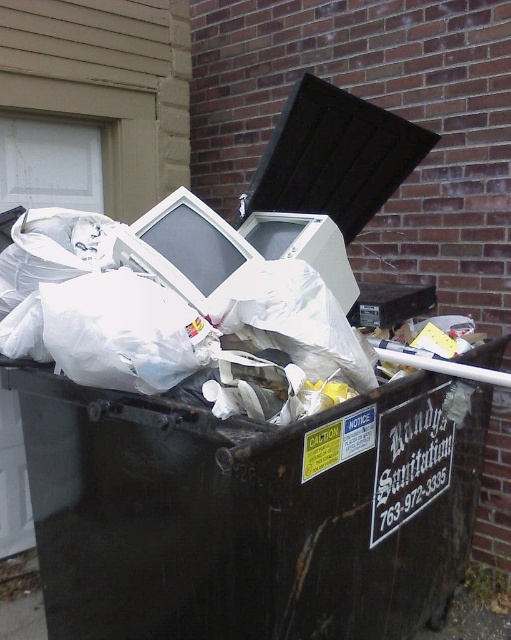
Does point (141, 218) lie in front of point (336, 292)?

No.

How far apart are matte white monitor at center and matte plastic computer monitor at center?

The distance of matte white monitor at center from matte plastic computer monitor at center is 10.93 inches.

Which is in front, point (181, 221) or point (355, 300)?

Point (181, 221)

The image size is (511, 640). I want to click on matte white monitor at center, so click(x=184, y=248).